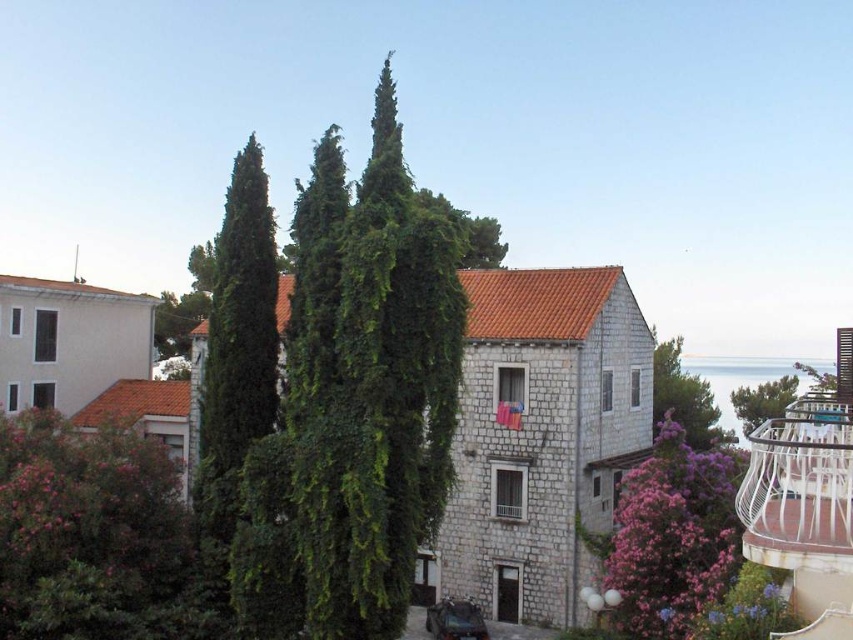
You are standing in the coastal scene and want to place a small garden ornament between the green leafy cypress at center and the green leafy bush at lower left. Based on their positions, where should you place the ornament to ensure it is between them?

The green leafy cypress at center is located above the green leafy bush at lower left, so placing the ornament between them would require positioning it below the cypress and above the bush.

You are a landscape architect designing a garden path that needs to pass between the green leafy cypress at center and the green leafy tree at upper center. Based on their thickness, which tree should you consider for providing more shade coverage along the path?

The green leafy tree at upper center is thicker than the green leafy cypress at center, so it would provide more shade coverage along the path.